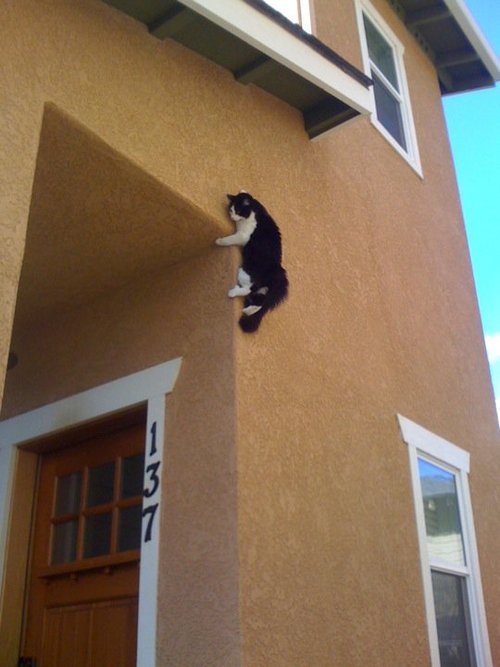
Identify the location of windows. Image resolution: width=500 pixels, height=667 pixels. (394, 107), (280, 1), (446, 536).